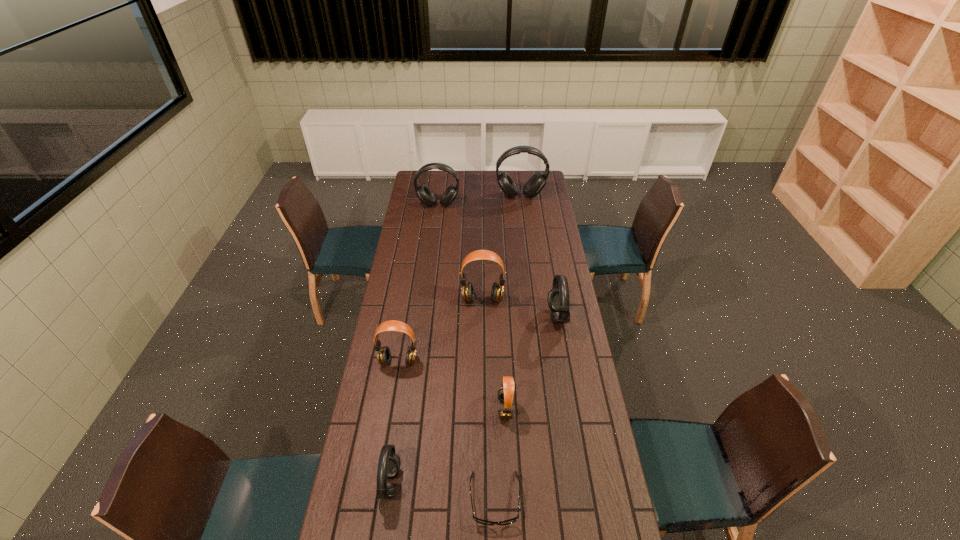
At what (x,y) coordinates should I click in order to perform the action: click on the tallest headset. Please return your answer as a coordinate pair (x, y). Looking at the image, I should click on (537, 181).

Image resolution: width=960 pixels, height=540 pixels. Find the location of `the biggest gray headset`. the biggest gray headset is located at coordinates (537, 181).

What are the coordinates of `the third smallest gray headset` in the screenshot? It's located at (426, 196).

I want to click on the farthest brown headset, so click(497, 291).

The image size is (960, 540). What are the coordinates of `the second nearest gray headset` in the screenshot? It's located at (558, 297).

Identify the location of the second smallest brown headset. (383, 353).

You are a GUI agent. You are given a task and a screenshot of the screen. Output one action in this format:
    pyautogui.click(x=<x>, y=<y>)
    Task: Click on the leftmost brown headset
    The width and height of the screenshot is (960, 540).
    Given the screenshot: What is the action you would take?
    pyautogui.click(x=383, y=353)

Find the location of a particular element. The height and width of the screenshot is (540, 960). the nearest brown headset is located at coordinates (505, 394).

Where is `the third nearest object`? the third nearest object is located at coordinates (505, 394).

Locate an element on the screen. the nearest gray headset is located at coordinates (389, 463).